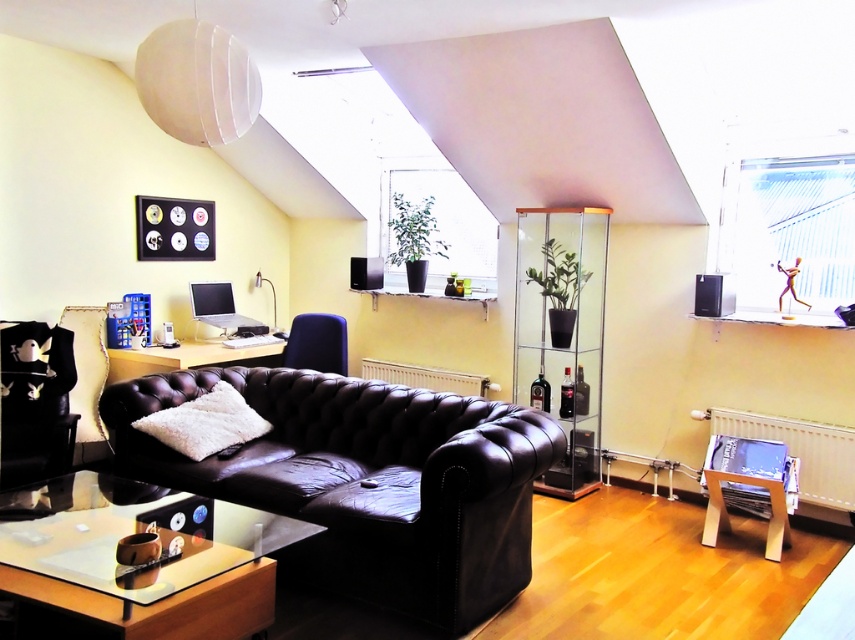
Does black leather armchair at left come in front of matte blue armchair at center?

Yes, it is.

Which of these two, black leather armchair at left or matte blue armchair at center, stands shorter?

matte blue armchair at center is shorter.

What do you see at coordinates (34, 403) in the screenshot? I see `black leather armchair at left` at bounding box center [34, 403].

Locate an element on the screen. The image size is (855, 640). black leather armchair at left is located at coordinates tap(34, 403).

Which is more to the left, translucent glass table at center or matte blue armchair at center?

translucent glass table at center is more to the left.

Between translucent glass table at center and matte blue armchair at center, which one is positioned higher?

matte blue armchair at center is above.

This screenshot has width=855, height=640. Describe the element at coordinates (187, 356) in the screenshot. I see `translucent glass table at center` at that location.

I want to click on translucent glass table at center, so point(187,356).

The width and height of the screenshot is (855, 640). Describe the element at coordinates (187, 356) in the screenshot. I see `translucent glass table at center` at that location.

Locate an element on the screen. The width and height of the screenshot is (855, 640). translucent glass table at center is located at coordinates (187, 356).

The image size is (855, 640). I want to click on translucent glass table at center, so click(x=187, y=356).